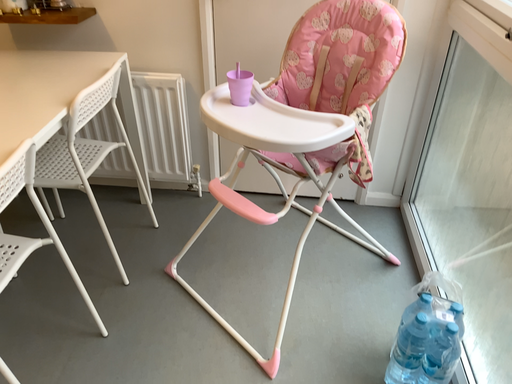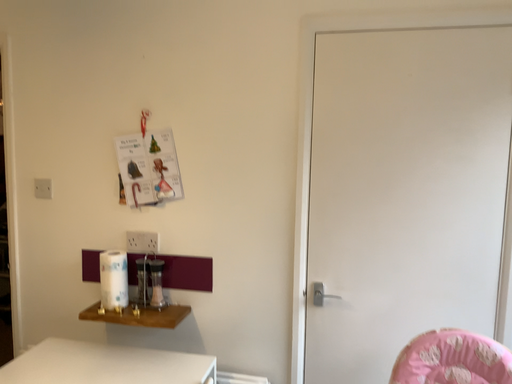
Question: Which way did the camera rotate in the video?

Choices:
 (A) rotated upward
 (B) rotated downward

Answer: (A)